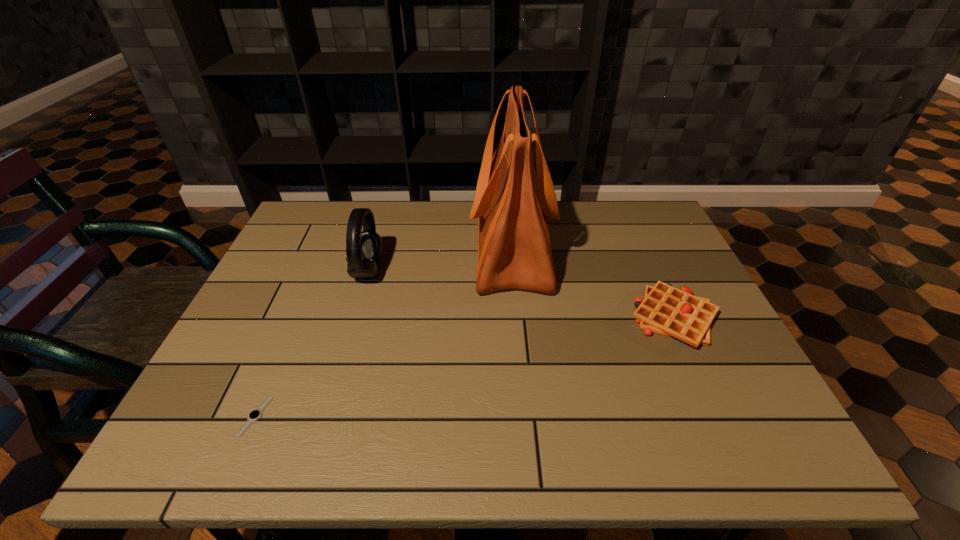
Image resolution: width=960 pixels, height=540 pixels. What are the coordinates of `free point at the near edge` in the screenshot? It's located at (618, 448).

The image size is (960, 540). In order to click on free space at the left edge of the desktop in this screenshot , I will do `click(189, 410)`.

Image resolution: width=960 pixels, height=540 pixels. In the image, there is a desktop. What are the coordinates of `vacant space at the right edge` in the screenshot? It's located at (695, 375).

The width and height of the screenshot is (960, 540). In order to click on vacant region at the far left corner in this screenshot , I will do `click(320, 220)`.

The width and height of the screenshot is (960, 540). I want to click on free space between the watch and the headset, so click(312, 343).

Identify the location of empty space between the leftmost object and the third tallest object. (465, 367).

Where is `empty location between the headset and the shopping bag`? The height and width of the screenshot is (540, 960). empty location between the headset and the shopping bag is located at coordinates (440, 259).

I want to click on free area in between the second object from left to right and the waffle, so click(521, 294).

Find the location of a particular element. The width and height of the screenshot is (960, 540). free spot between the nearest object and the rightmost object is located at coordinates (465, 367).

The image size is (960, 540). I want to click on vacant area that lies between the headset and the waffle, so click(521, 294).